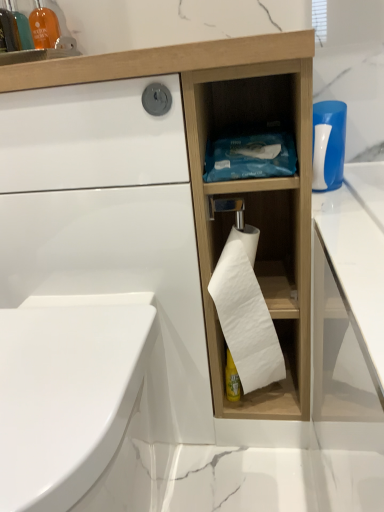
Question: From a real-world perspective, is white glossy bidet at lower left positioned above or below matte orange glass at upper left?

Choices:
 (A) below
 (B) above

Answer: (A)

Question: Is white glossy bidet at lower left situated inside matte orange glass at upper left or outside?

Choices:
 (A) inside
 (B) outside

Answer: (B)

Question: Which object is the farthest from the wooden tissue holder at center?

Choices:
 (A) white matte toilet paper at center
 (B) white glossy bidet at lower left
 (C) matte orange glass at upper left
 (D) translucent orange bottle at upper left
 (E) white plastic bottle at upper right

Answer: (D)

Question: Which of these objects is positioned farthest from the white glossy bidet at lower left?

Choices:
 (A) white matte toilet paper at center
 (B) matte orange glass at upper left
 (C) wooden tissue holder at center
 (D) white plastic bottle at upper right
 (E) translucent orange bottle at upper left

Answer: (E)